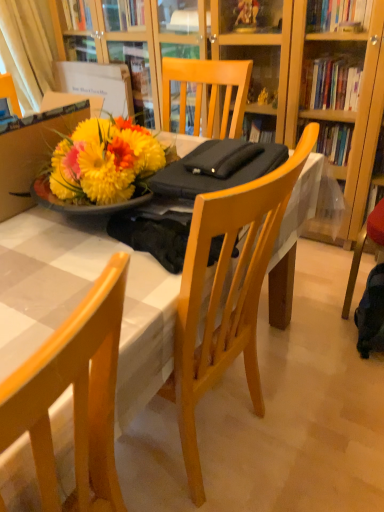
Question: From a real-world perspective, is white fabric curtain at upper left over dark blue fabric backpack at lower right?

Choices:
 (A) yes
 (B) no

Answer: (A)

Question: Would you consider white fabric curtain at upper left to be distant from dark blue fabric backpack at lower right?

Choices:
 (A) no
 (B) yes

Answer: (B)

Question: Considering the relative positions of white fabric curtain at upper left and dark blue fabric backpack at lower right in the image provided, is white fabric curtain at upper left in front of dark blue fabric backpack at lower right?

Choices:
 (A) yes
 (B) no

Answer: (B)

Question: Could dark blue fabric backpack at lower right be considered to be inside white fabric curtain at upper left?

Choices:
 (A) yes
 (B) no

Answer: (B)

Question: Is white fabric curtain at upper left positioned beyond the bounds of dark blue fabric backpack at lower right?

Choices:
 (A) no
 (B) yes

Answer: (B)

Question: Is white fabric curtain at upper left to the right of dark blue fabric backpack at lower right from the viewer's perspective?

Choices:
 (A) no
 (B) yes

Answer: (A)

Question: Is white glossy table at center facing towards white fabric curtain at upper left?

Choices:
 (A) yes
 (B) no

Answer: (B)

Question: Is white glossy table at center bigger than white fabric curtain at upper left?

Choices:
 (A) yes
 (B) no

Answer: (A)

Question: From a real-world perspective, is white glossy table at center physically above white fabric curtain at upper left?

Choices:
 (A) no
 (B) yes

Answer: (A)

Question: Is white glossy table at center taller than white fabric curtain at upper left?

Choices:
 (A) yes
 (B) no

Answer: (A)

Question: Would you say white fabric curtain at upper left is part of white glossy table at center's contents?

Choices:
 (A) yes
 (B) no

Answer: (B)

Question: Is white glossy table at center not close to white fabric curtain at upper left?

Choices:
 (A) no
 (B) yes

Answer: (B)

Question: From the image's perspective, is white glossy table at center over dark blue fabric backpack at lower right?

Choices:
 (A) no
 (B) yes

Answer: (B)